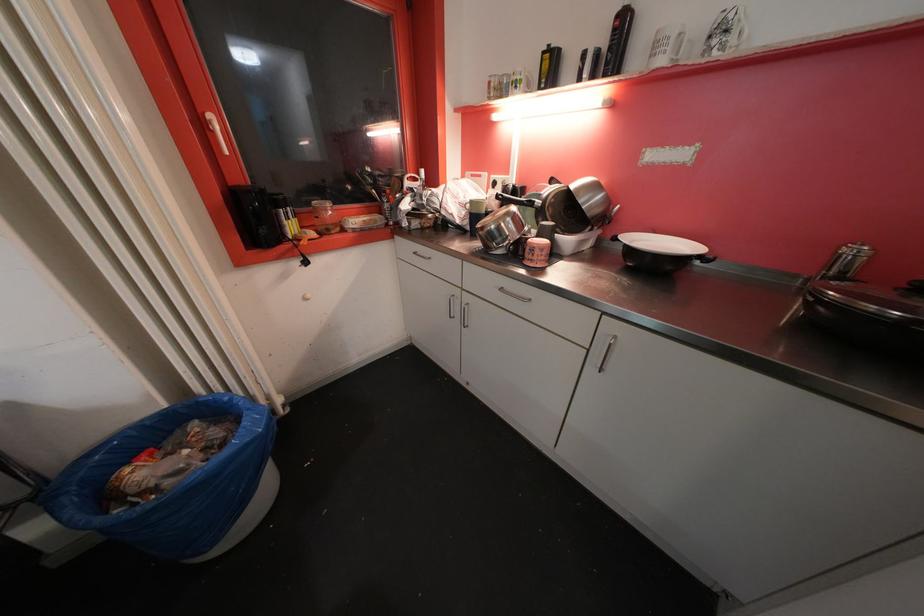
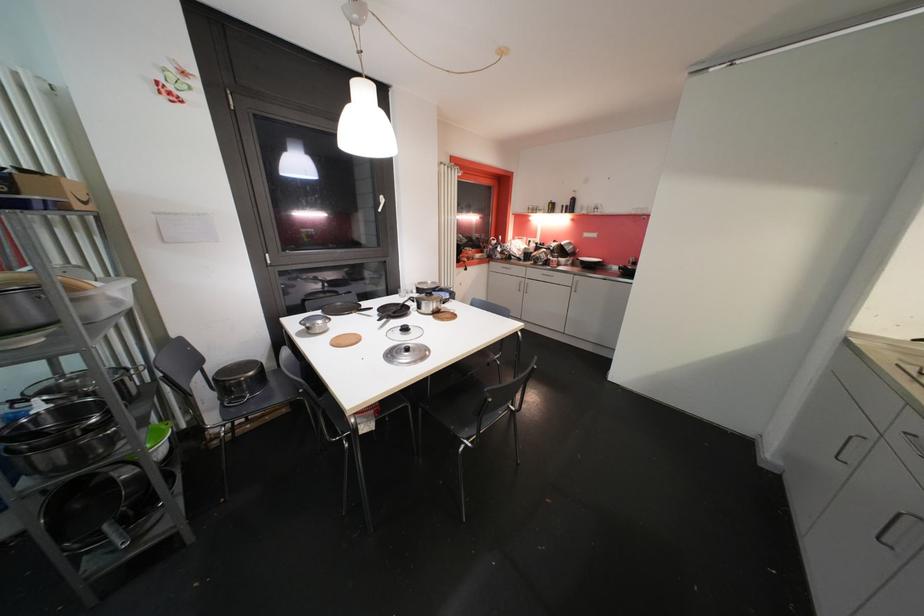
Which direction would the cameraman need to move to produce the second image?

The cameraman walked toward left, backward.